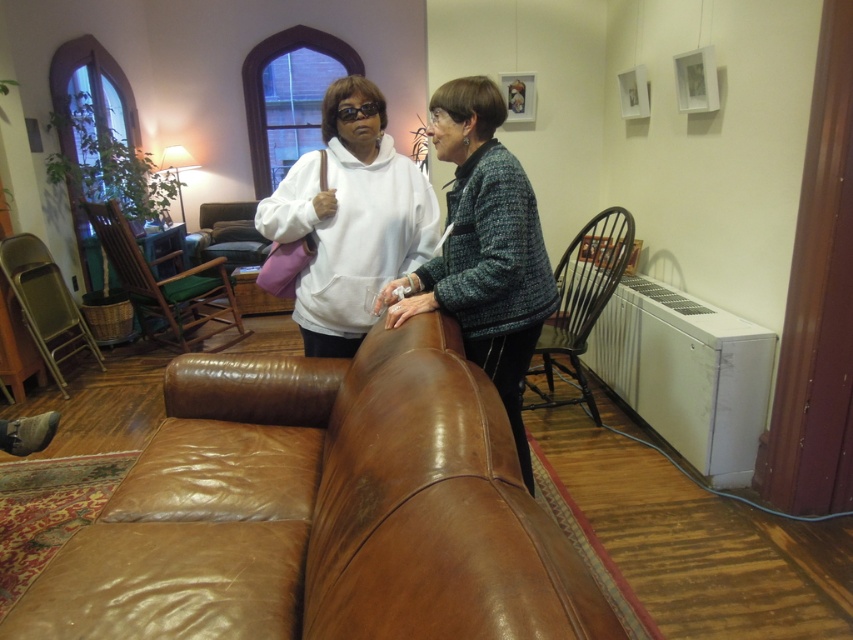
Can you confirm if brown leather armchair at left is positioned to the left of leather armchair at center?

Incorrect, brown leather armchair at left is not on the left side of leather armchair at center.

This screenshot has height=640, width=853. What do you see at coordinates (167, 284) in the screenshot?
I see `brown leather armchair at left` at bounding box center [167, 284].

The image size is (853, 640). What are the coordinates of `brown leather armchair at left` in the screenshot? It's located at (167, 284).

Between brown leather couch at center and matte brown leather couch at center, which one has less height?

brown leather couch at center is shorter.

Which of these two, brown leather couch at center or matte brown leather couch at center, stands taller?

matte brown leather couch at center is taller.

Between point (486, 512) and point (477, 342), which one is positioned behind?

Point (477, 342)

This screenshot has height=640, width=853. In order to click on brown leather couch at center in this screenshot , I will do `click(322, 512)`.

Who is higher up, brown leather couch at center or leather armchair at center?

leather armchair at center

Is point (463, 576) in front of point (230, 228)?

That is True.

Measure the distance between brown leather couch at center and camera.

A distance of 28.63 inches exists between brown leather couch at center and camera.

The image size is (853, 640). Find the location of `brown leather couch at center`. brown leather couch at center is located at coordinates click(322, 512).